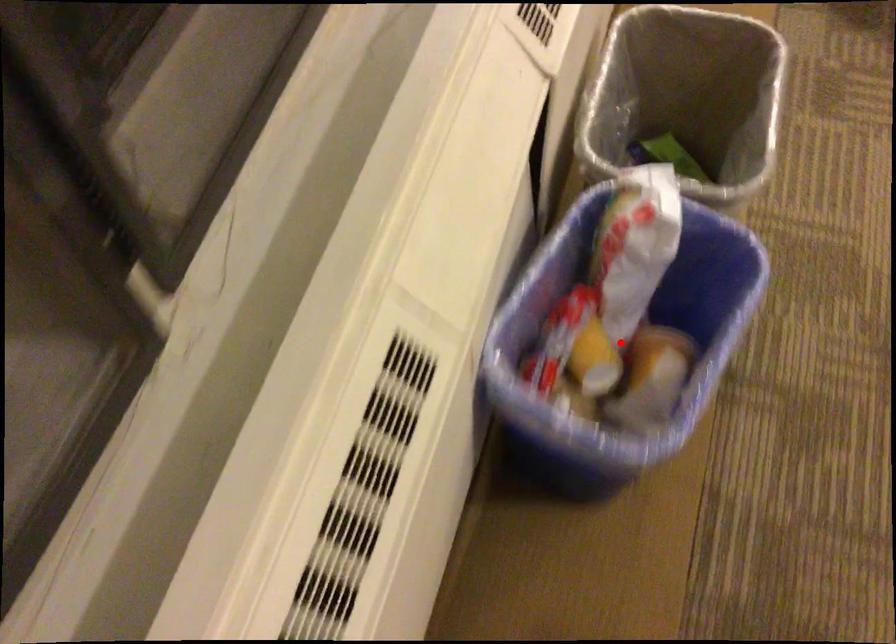
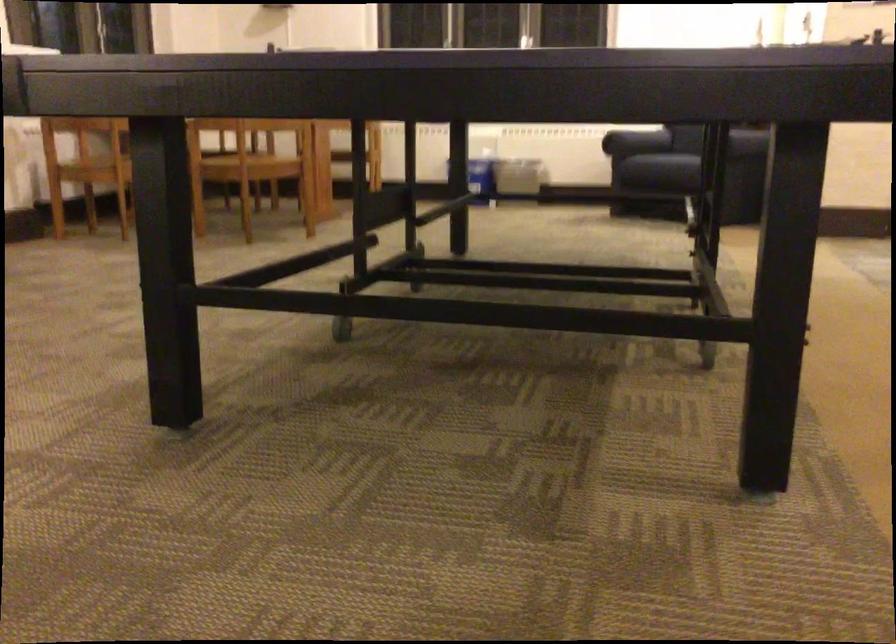
Question: I am providing you with two images of the same scene from different viewpoints. A red point is marked on the first image. At the location where the point appears in image 1, is it still visible in image 2?

Choices:
 (A) Yes
 (B) No

Answer: (B)